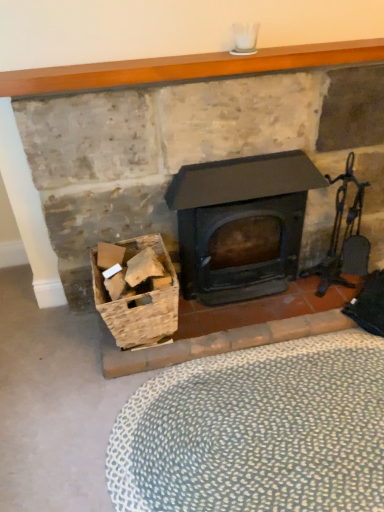
The width and height of the screenshot is (384, 512). I want to click on vacant area in front of metallic dark brown fireplace tool set at right, so click(327, 319).